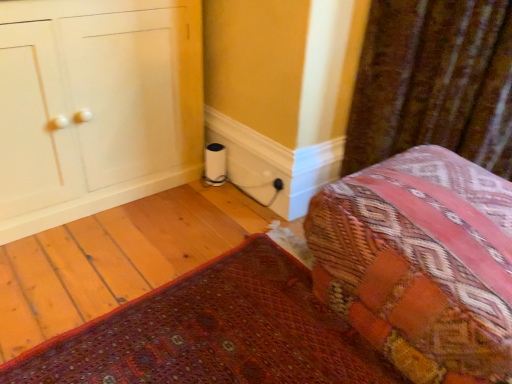
This screenshot has height=384, width=512. Describe the element at coordinates (96, 106) in the screenshot. I see `white glossy cabinet at left, the second furniture ordered from the bottom` at that location.

Describe the element at coordinates (278, 184) in the screenshot. I see `black plastic electric outlet at lower right` at that location.

This screenshot has width=512, height=384. Describe the element at coordinates (326, 295) in the screenshot. I see `patterned fabric cushion at lower right, which ranks as the 1th furniture in bottom-to-top order` at that location.

From the picture: Measure the distance between point (478, 40) and camera.

Point (478, 40) is 1.45 meters from camera.

What do you see at coordinates (434, 82) in the screenshot? I see `velvet brown curtain at upper right` at bounding box center [434, 82].

Find the location of `white glossy cabinet at left, the second furniture ordered from the bottom`. white glossy cabinet at left, the second furniture ordered from the bottom is located at coordinates (96, 106).

Relative to black plastic electric outlet at lower right, is textured woven bed at lower right in front or behind?

Visually, textured woven bed at lower right is located in front of black plastic electric outlet at lower right.

You are a GUI agent. You are given a task and a screenshot of the screen. Output one action in this format:
    pyautogui.click(x=<x>, y=<y>)
    Task: Click on the electric outlet above the textured woven bed at lower right (from the image's perspective)
    The width and height of the screenshot is (512, 384).
    Given the screenshot: What is the action you would take?
    pyautogui.click(x=278, y=184)

Looking at their sizes, would you say textured woven bed at lower right is wider or thinner than black plastic electric outlet at lower right?

In the image, textured woven bed at lower right appears to be wider than black plastic electric outlet at lower right.

Which is in front, point (402, 238) or point (276, 183)?

The point (402, 238) is in front.

Does patterned fabric cushion at lower right, marked as the second furniture in a top-to-bottom arrangement, have a lesser height compared to black plastic electric outlet at lower right?

Incorrect, the height of patterned fabric cushion at lower right, marked as the second furniture in a top-to-bottom arrangement, does not fall short of that of black plastic electric outlet at lower right.

The height and width of the screenshot is (384, 512). I want to click on electric outlet that appears above the patterned fabric cushion at lower right, which ranks as the 1th furniture in bottom-to-top order (from the image's perspective), so click(278, 184).

Which of these two, black plastic electric outlet at lower right or textured woven bed at lower right, is thinner?

black plastic electric outlet at lower right is thinner.

Is black plastic electric outlet at lower right with textured woven bed at lower right?

No, black plastic electric outlet at lower right is not next to textured woven bed at lower right.

Would you say black plastic electric outlet at lower right is to the left or to the right of textured woven bed at lower right in the picture?

From the image, it's evident that black plastic electric outlet at lower right is to the left of textured woven bed at lower right.

Image resolution: width=512 pixels, height=384 pixels. I want to click on electric outlet above the textured woven bed at lower right (from the image's perspective), so click(x=278, y=184).

From a real-world perspective, is black plastic electric outlet at lower right on top of patterned fabric cushion at lower right, which ranks as the 1th furniture in bottom-to-top order?

Yes.

Is patterned fabric cushion at lower right, marked as the second furniture in a top-to-bottom arrangement, completely or partially inside black plastic electric outlet at lower right?

Definitely not — patterned fabric cushion at lower right, marked as the second furniture in a top-to-bottom arrangement, is not inside black plastic electric outlet at lower right.

Identify the location of electric outlet that appears above the patterned fabric cushion at lower right, marked as the second furniture in a top-to-bottom arrangement (from the image's perspective). (278, 184).

Is point (277, 191) behind point (390, 364)?

Yes.

Does point (279, 182) lie in front of point (431, 69)?

No, (279, 182) is further to viewer.

Does black plastic electric outlet at lower right have a larger size compared to velvet brown curtain at upper right?

No, black plastic electric outlet at lower right is not bigger than velvet brown curtain at upper right.

Is the position of black plastic electric outlet at lower right more distant than that of velvet brown curtain at upper right?

That is True.

Is white glossy cabinet at left, the second furniture ordered from the bottom, not inside black plastic electric outlet at lower right?

That's correct, white glossy cabinet at left, the second furniture ordered from the bottom, is outside of black plastic electric outlet at lower right.

Is the depth of white glossy cabinet at left, the second furniture ordered from the bottom, less than that of black plastic electric outlet at lower right?

Yes, it is.

Is white glossy cabinet at left, the second furniture ordered from the bottom, oriented away from black plastic electric outlet at lower right?

No, black plastic electric outlet at lower right is not at the back of white glossy cabinet at left, the second furniture ordered from the bottom.

Considering the sizes of objects white glossy cabinet at left, the second furniture ordered from the bottom, and black plastic electric outlet at lower right in the image provided, who is taller, white glossy cabinet at left, the second furniture ordered from the bottom, or black plastic electric outlet at lower right?

white glossy cabinet at left, the second furniture ordered from the bottom, is taller.

How much distance is there between white glossy cabinet at left, the second furniture ordered from the bottom, and textured woven bed at lower right?

white glossy cabinet at left, the second furniture ordered from the bottom, and textured woven bed at lower right are 1.11 meters apart.

Consider the image. Would you say textured woven bed at lower right is part of white glossy cabinet at left, which is counted as the 1th furniture, starting from the top,'s contents?

Actually, textured woven bed at lower right is outside white glossy cabinet at left, which is counted as the 1th furniture, starting from the top.

Which of these two, white glossy cabinet at left, which is counted as the 1th furniture, starting from the top, or textured woven bed at lower right, stands taller?

With more height is white glossy cabinet at left, which is counted as the 1th furniture, starting from the top.

Are white glossy cabinet at left, which is counted as the 1th furniture, starting from the top, and textured woven bed at lower right far apart?

That's right, there is a large distance between white glossy cabinet at left, which is counted as the 1th furniture, starting from the top, and textured woven bed at lower right.

Identify the location of electric outlet that is on the left side of textured woven bed at lower right. (278, 184).

In the image, there is a black plastic electric outlet at lower right. Where is `furniture below it (from a real-world perspective)`? Image resolution: width=512 pixels, height=384 pixels. furniture below it (from a real-world perspective) is located at coordinates (326, 295).

Estimate the real-world distances between objects in this image. Which object is closer to velvet brown curtain at upper right, textured woven bed at lower right or white glossy cabinet at left, the second furniture ordered from the bottom?

textured woven bed at lower right is positioned closer to the anchor velvet brown curtain at upper right.

Based on their spatial positions, is textured woven bed at lower right or patterned fabric cushion at lower right, marked as the second furniture in a top-to-bottom arrangement, further from white glossy cabinet at left, the second furniture ordered from the bottom?

The object further to white glossy cabinet at left, the second furniture ordered from the bottom, is textured woven bed at lower right.

Looking at the image, which one is located closer to velvet brown curtain at upper right, black plastic electric outlet at lower right or patterned fabric cushion at lower right, marked as the second furniture in a top-to-bottom arrangement?

patterned fabric cushion at lower right, marked as the second furniture in a top-to-bottom arrangement, is closer to velvet brown curtain at upper right.

Looking at the image, which one is located closer to velvet brown curtain at upper right, white glossy cabinet at left, which is counted as the 1th furniture, starting from the top, or black plastic electric outlet at lower right?

The object closer to velvet brown curtain at upper right is black plastic electric outlet at lower right.

Which object lies nearer to the anchor point black plastic electric outlet at lower right, patterned fabric cushion at lower right, marked as the second furniture in a top-to-bottom arrangement, or textured woven bed at lower right?

patterned fabric cushion at lower right, marked as the second furniture in a top-to-bottom arrangement, lies closer to black plastic electric outlet at lower right than the other object.

Estimate the real-world distances between objects in this image. Which object is closer to velvet brown curtain at upper right, textured woven bed at lower right or patterned fabric cushion at lower right, marked as the second furniture in a top-to-bottom arrangement?

Among the two, patterned fabric cushion at lower right, marked as the second furniture in a top-to-bottom arrangement, is located nearer to velvet brown curtain at upper right.

Which object lies nearer to the anchor point textured woven bed at lower right, white glossy cabinet at left, the second furniture ordered from the bottom, or black plastic electric outlet at lower right?

black plastic electric outlet at lower right is positioned closer to the anchor textured woven bed at lower right.

Considering their positions, is velvet brown curtain at upper right positioned closer to black plastic electric outlet at lower right than white glossy cabinet at left, which is counted as the 1th furniture, starting from the top?

The object closer to black plastic electric outlet at lower right is velvet brown curtain at upper right.

Locate an element on the screen. The height and width of the screenshot is (384, 512). furniture located between white glossy cabinet at left, the second furniture ordered from the bottom, and textured woven bed at lower right in the left-right direction is located at coordinates (326, 295).

Locate an element on the screen. The width and height of the screenshot is (512, 384). electric outlet between white glossy cabinet at left, the second furniture ordered from the bottom, and velvet brown curtain at upper right is located at coordinates (278, 184).

At what (x,y) coordinates should I click in order to perform the action: click on bed between patterned fabric cushion at lower right, marked as the second furniture in a top-to-bottom arrangement, and black plastic electric outlet at lower right, along the z-axis. Please return your answer as a coordinate pair (x, y). Looking at the image, I should click on (420, 263).

Locate an element on the screen. This screenshot has height=384, width=512. bed between patterned fabric cushion at lower right, marked as the second furniture in a top-to-bottom arrangement, and velvet brown curtain at upper right, in the horizontal direction is located at coordinates (420, 263).